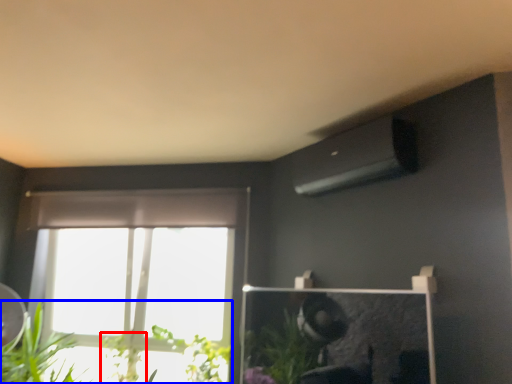
Question: Among these objects, which one is nearest to the camera, plant (highlighted by a red box) or houseplant (highlighted by a blue box)?

Choices:
 (A) plant
 (B) houseplant

Answer: (B)